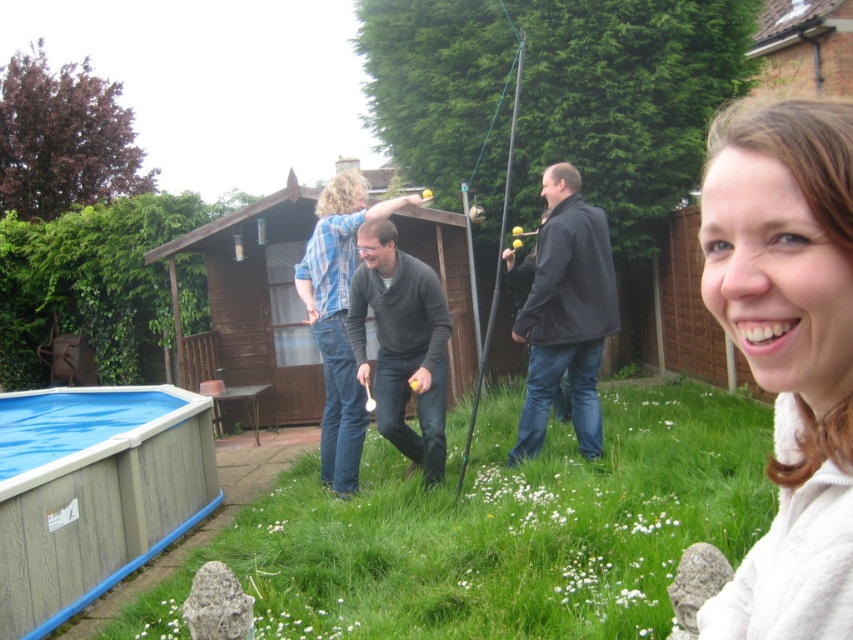
Is black matte jacket at center further to camera compared to metallic silver fishing pole at center?

No, it is in front of metallic silver fishing pole at center.

Can you confirm if black matte jacket at center is bigger than metallic silver fishing pole at center?

Yes, black matte jacket at center is bigger than metallic silver fishing pole at center.

Identify the location of black matte jacket at center. This screenshot has width=853, height=640. (566, 314).

Does gray sweater at center have a lesser width compared to matte gray sweater at center?

Indeed, gray sweater at center has a lesser width compared to matte gray sweater at center.

Can you confirm if gray sweater at center is smaller than matte gray sweater at center?

Indeed, gray sweater at center has a smaller size compared to matte gray sweater at center.

Does point (376, 289) come behind point (329, 456)?

No, (376, 289) is in front of (329, 456).

The width and height of the screenshot is (853, 640). Identify the location of gray sweater at center. (402, 342).

Can you confirm if green grass at lower center is smaller than gray sweater at center?

No, green grass at lower center is not smaller than gray sweater at center.

Between green grass at lower center and gray sweater at center, which one is positioned higher?

gray sweater at center is higher up.

Is point (399, 608) positioned before point (403, 288)?

That is True.

In order to click on green grass at lower center in this screenshot , I will do `click(498, 532)`.